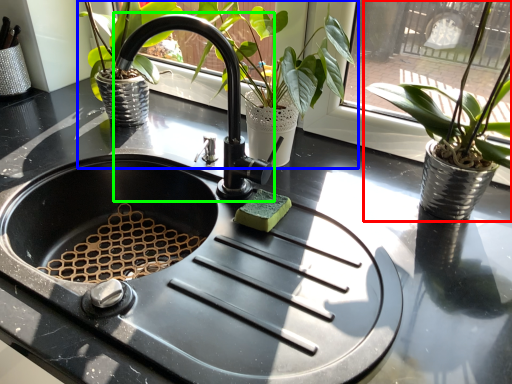
Question: Estimate the real-world distances between objects in this image. Which object is farther from houseplant (highlighted by a red box), houseplant (highlighted by a blue box) or faucet (highlighted by a green box)?

Choices:
 (A) houseplant
 (B) faucet

Answer: (B)